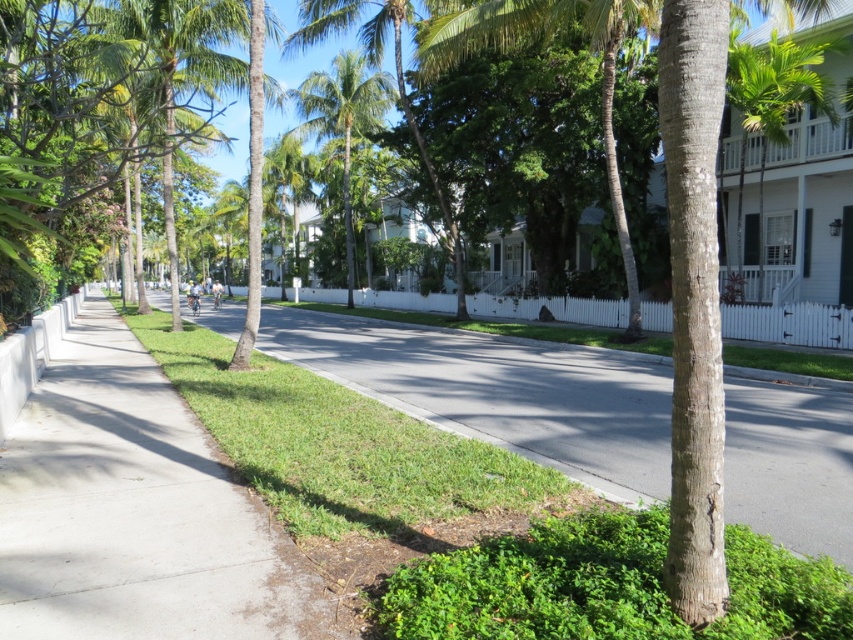
You are a landscape architect designing a new suburban street. You want to place a small garden between the green leafy palm tree at upper right and the green leafy palm tree at center. Based on their sizes, which palm tree would you choose as the focal point of the garden?

The green leafy palm tree at center is larger than the green leafy palm tree at upper right, so it would be the better choice as the focal point of the garden.

You are a delivery person trying to walk along the gray concrete sidewalk at center while avoiding the shadows of the green leafy palm tree at upper right. Since the tree is casting a shadow on the sidewalk, can you walk around it by moving closer to the white picket fence on the right?

The gray concrete sidewalk at center is closer to the viewer than the green leafy palm tree at upper right, so the shadow of the green leafy palm tree at upper right would be cast towards the sidewalk. Since the sidewalk is closer to you, you can walk closer to the white picket fence on the right to avoid the shadow.

You are a gardener who needs to mow the lawn. You see the green grass at lower left and the green leafy palm tree at center. Which one is shorter?

The green grass at lower left is shorter than the green leafy palm tree at center.